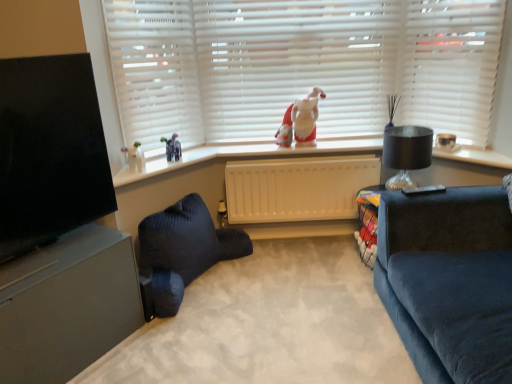
Find the location of `vacant space situated above velvet dark blue pillow at lower left (from a real-world perspective)`. vacant space situated above velvet dark blue pillow at lower left (from a real-world perspective) is located at coordinates (259, 305).